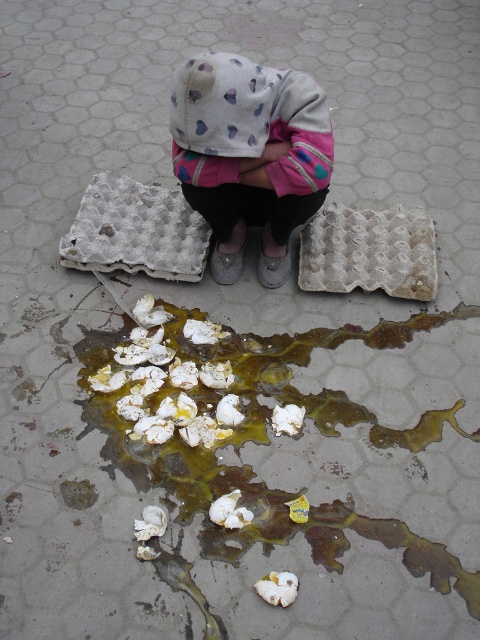
Is white crumbly eggshells at lower center bigger than white cardboard egg carton at lower center?

Yes.

How much distance is there between white crumbly eggshells at lower center and white cardboard egg carton at lower center?

white crumbly eggshells at lower center and white cardboard egg carton at lower center are 13.74 inches apart.

Which is behind, point (247, 477) or point (308, 282)?

The point (308, 282) is more distant.

What are the coordinates of `white crumbly eggshells at lower center` in the screenshot? It's located at (264, 506).

Can you confirm if white crumbly eggshells at lower center is wider than white cardboard egg carton at center?

Yes, white crumbly eggshells at lower center is wider than white cardboard egg carton at center.

Does white crumbly eggshells at lower center have a lesser width compared to white cardboard egg carton at center?

In fact, white crumbly eggshells at lower center might be wider than white cardboard egg carton at center.

Does point (229, 438) come closer to viewer compared to point (145, 228)?

That is True.

What are the coordinates of `white crumbly eggshells at lower center` in the screenshot? It's located at (264, 506).

How much distance is there between white crumbly eggshells at lower center and white cotton hoodie at center?

50.64 centimeters

Image resolution: width=480 pixels, height=640 pixels. What do you see at coordinates (264, 506) in the screenshot?
I see `white crumbly eggshells at lower center` at bounding box center [264, 506].

Is point (317, 509) positioned in front of point (264, 237)?

Yes, point (317, 509) is in front of point (264, 237).

Locate an element on the screen. white crumbly eggshells at lower center is located at coordinates (264, 506).